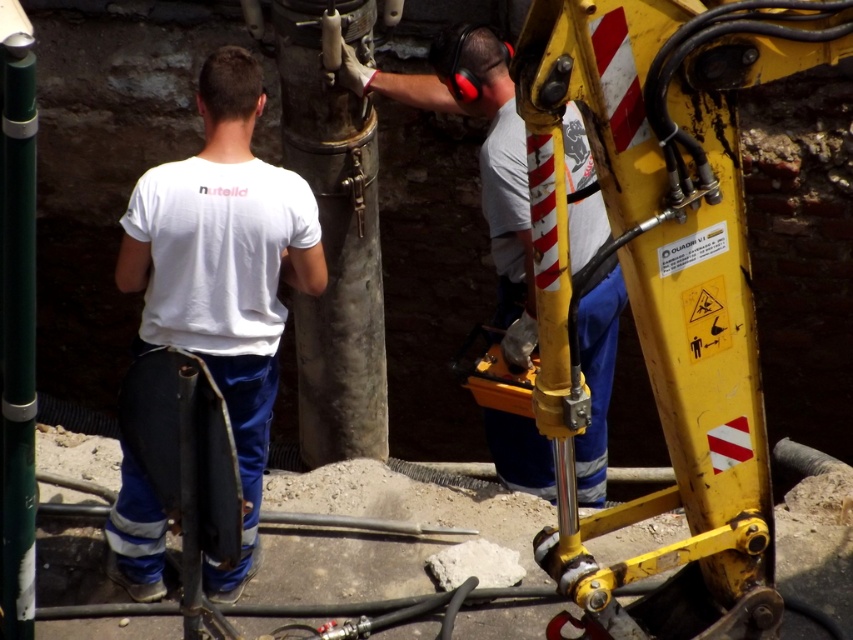
Which of these two, white cotton shirt at center or matte yellow tool at center, stands shorter?

Standing shorter between the two is matte yellow tool at center.

What do you see at coordinates (224, 272) in the screenshot? The image size is (853, 640). I see `white cotton shirt at center` at bounding box center [224, 272].

Between point (248, 346) and point (509, 83), which one is positioned behind?

Positioned behind is point (509, 83).

This screenshot has height=640, width=853. What are the coordinates of `white cotton shirt at center` in the screenshot? It's located at (224, 272).